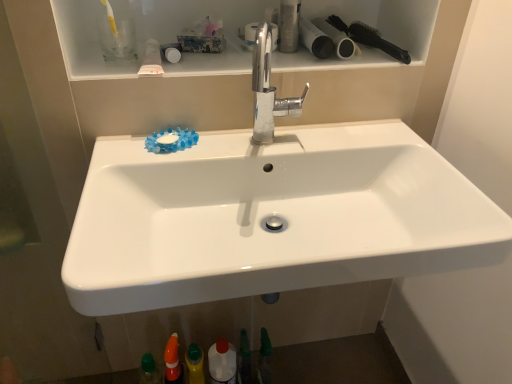
Question: In terms of width, does black plastic brush at upper right look wider or thinner when compared to matte white toilet paper at upper right, which is counted as the 2th toilet paper, starting from the right?

Choices:
 (A) wide
 (B) thin

Answer: (A)

Question: From a real-world perspective, is black plastic brush at upper right positioned above or below matte white toilet paper at upper right, the 1th toilet paper viewed from the left?

Choices:
 (A) above
 (B) below

Answer: (B)

Question: Which object is positioned farthest from the green matte toothpaste at lower center, positioned as the 2th toiletry in right-to-left order?

Choices:
 (A) green matte bottle at lower center, which ranks as the 3th toiletry in bottom-to-top order
 (B) matte white toilet paper at upper right, which is counted as the 2th toilet paper, starting from the right
 (C) white glossy bottle at lower center
 (D) yellow matte bottle at lower center, positioned as the second toiletry in left-to-right order
 (E) black matte toilet paper at upper right, the first toilet paper when ordered from right to left

Answer: (E)

Question: Based on their relative distances, which object is farther from the green matte bottle at lower center, which appears as the third toiletry when viewed from the top?

Choices:
 (A) orange plastic cone at lower center, the 1th toiletry positioned from the left
 (B) white glossy bottle at lower center
 (C) matte white toilet paper at upper right, the 1th toilet paper viewed from the left
 (D) yellow matte bottle at lower center, the fifth toiletry when ordered from top to bottom
 (E) green matte toothpaste at lower center, positioned as the 2th toiletry in right-to-left order

Answer: (C)